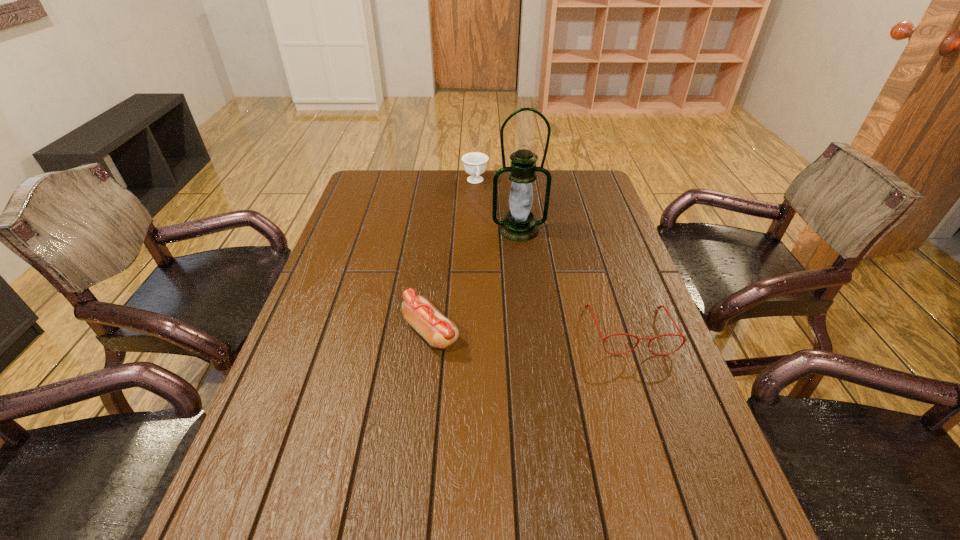
Where is `sausage`? sausage is located at coordinates (440, 332).

The width and height of the screenshot is (960, 540). In order to click on spectacles in this screenshot , I will do `click(658, 307)`.

You are a GUI agent. You are given a task and a screenshot of the screen. Output one action in this format:
    pyautogui.click(x=<x>, y=<y>)
    Task: Click on the tallest object
    This screenshot has height=540, width=960.
    Given the screenshot: What is the action you would take?
    pyautogui.click(x=519, y=224)

Identify the location of the second object from right to left. This screenshot has width=960, height=540. (519, 224).

Identify the location of the farthest object. The image size is (960, 540). (474, 162).

You are a GUI agent. You are given a task and a screenshot of the screen. Output one action in this format:
    pyautogui.click(x=<x>, y=<y>)
    Task: Click on the vacant space located on the back of the sausage
    Image resolution: width=960 pixels, height=540 pixels.
    Given the screenshot: What is the action you would take?
    443,228

Identify the location of vacant space located 0.210m on the face of the spectacles. Image resolution: width=960 pixels, height=540 pixels. (666, 438).

I want to click on vacant space located 0.150m on the side where the lantern emits light, so click(x=525, y=273).

At what (x,y) coordinates should I click in order to perform the action: click on vacant point located on the side where the lantern emits light. Please return your answer as a coordinate pair (x, y). This screenshot has height=540, width=960. Looking at the image, I should click on (526, 280).

The width and height of the screenshot is (960, 540). What are the coordinates of `blank area located on the side where the lantern emits light` in the screenshot? It's located at (533, 330).